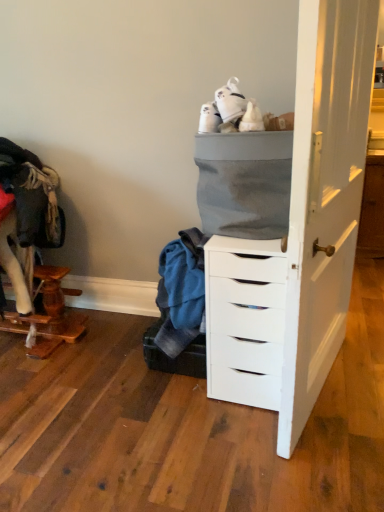
Question: Should I look upward or downward to see gray fabric basket at upper center?

Choices:
 (A) up
 (B) down

Answer: (A)

Question: Can you confirm if white matte chest of drawers at center is wider than wooden cat tree at left?

Choices:
 (A) yes
 (B) no

Answer: (A)

Question: Could you tell me if white matte chest of drawers at center is facing wooden cat tree at left?

Choices:
 (A) yes
 (B) no

Answer: (B)

Question: Can wooden cat tree at left be found inside white matte chest of drawers at center?

Choices:
 (A) yes
 (B) no

Answer: (B)

Question: Is white matte chest of drawers at center smaller than wooden cat tree at left?

Choices:
 (A) no
 (B) yes

Answer: (B)

Question: Is the position of white matte chest of drawers at center more distant than that of wooden cat tree at left?

Choices:
 (A) yes
 (B) no

Answer: (B)

Question: From a real-world perspective, is white matte chest of drawers at center located beneath wooden cat tree at left?

Choices:
 (A) no
 (B) yes

Answer: (A)

Question: Is wooden cat tree at left positioned in front of gray fabric basket at upper center?

Choices:
 (A) yes
 (B) no

Answer: (B)

Question: Can you confirm if wooden cat tree at left is positioned to the right of gray fabric basket at upper center?

Choices:
 (A) yes
 (B) no

Answer: (B)

Question: Considering the relative sizes of wooden cat tree at left and gray fabric basket at upper center in the image provided, is wooden cat tree at left smaller than gray fabric basket at upper center?

Choices:
 (A) yes
 (B) no

Answer: (B)

Question: From a real-world perspective, is wooden cat tree at left positioned over gray fabric basket at upper center based on gravity?

Choices:
 (A) yes
 (B) no

Answer: (B)

Question: Would you say gray fabric basket at upper center is part of wooden cat tree at left's contents?

Choices:
 (A) yes
 (B) no

Answer: (B)

Question: From a real-world perspective, is wooden cat tree at left beneath gray fabric basket at upper center?

Choices:
 (A) yes
 (B) no

Answer: (A)

Question: Could you tell me if wooden cat tree at left is turned towards white matte chest of drawers at center?

Choices:
 (A) no
 (B) yes

Answer: (A)